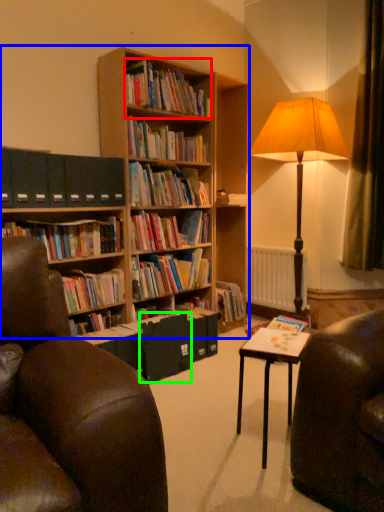
Question: Which object is positioned farthest from book (highlighted by a red box)? Select from bookcase (highlighted by a blue box) and paperback book (highlighted by a green box).

Choices:
 (A) bookcase
 (B) paperback book

Answer: (B)